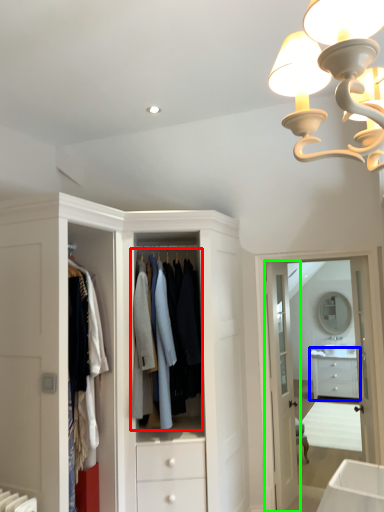
Question: Considering the real-world distances, which object is closest to clothing (highlighted by a red box)? chest of drawers (highlighted by a blue box) or door (highlighted by a green box).

Choices:
 (A) chest of drawers
 (B) door

Answer: (B)